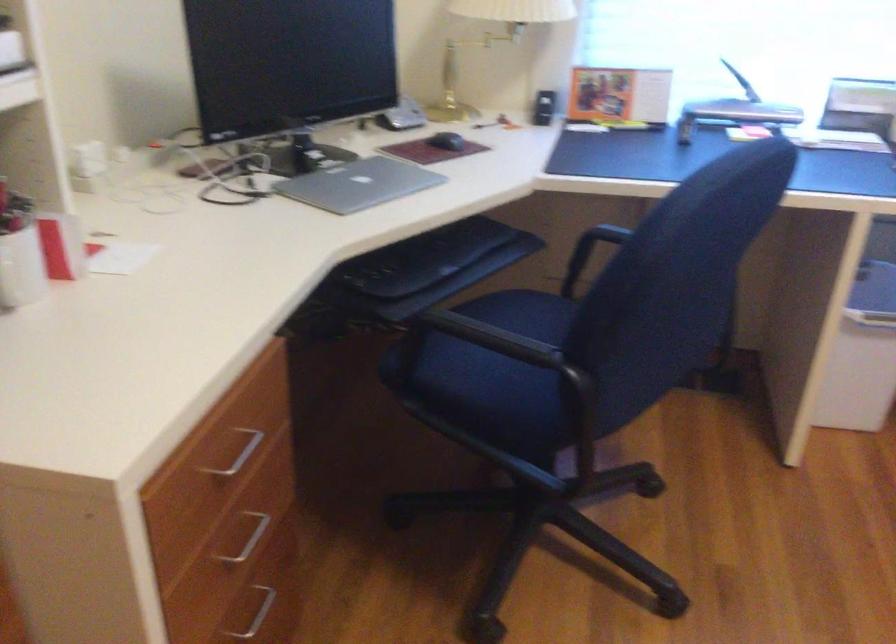
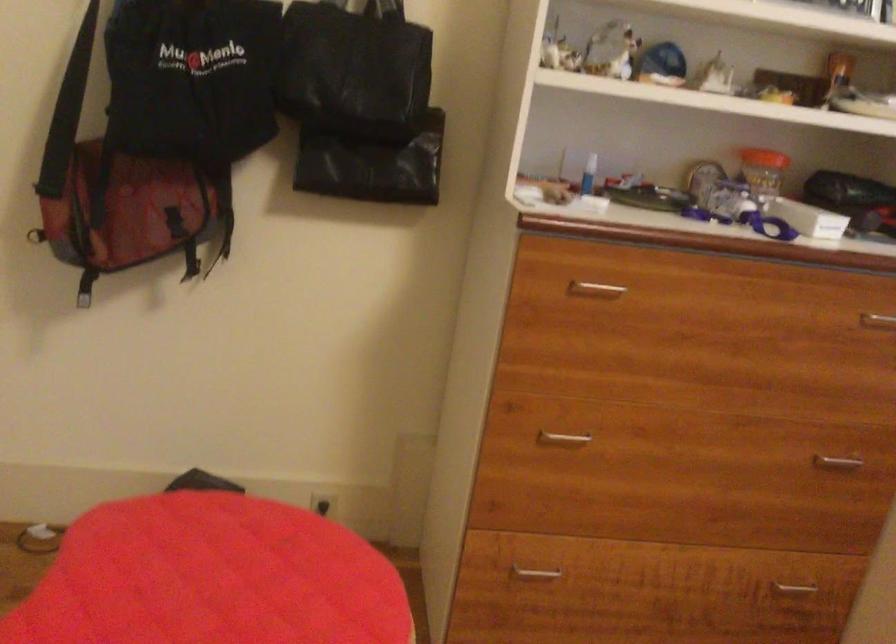
Question: The first image is from the beginning of the video and the second image is from the end. How did the camera likely rotate when shooting the video?

Choices:
 (A) Left
 (B) Right
 (C) Up
 (D) Down

Answer: (A)